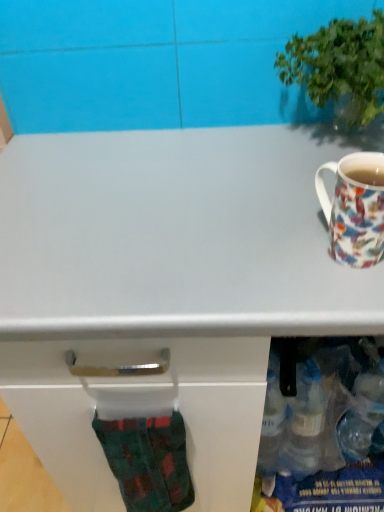
Measure the distance between point (351, 118) and camera.

Point (351, 118) is 30.83 inches away from camera.

What do you see at coordinates (148, 461) in the screenshot? The image size is (384, 512). I see `green plaid sock at lower left` at bounding box center [148, 461].

What is the approximate height of porcelain floral mug at right?

4.62 inches.

This screenshot has width=384, height=512. What are the coordinates of `green leafy plant at upper right` in the screenshot? It's located at (340, 68).

Does point (171, 454) come closer to viewer compared to point (305, 57)?

No, it is behind (305, 57).

From the image's perspective, relative to green leafy plant at upper right, is green plaid sock at lower left above or below?

green plaid sock at lower left is below green leafy plant at upper right.

Can you tell me how much green plaid sock at lower left and green leafy plant at upper right differ in facing direction?

2.52 degrees separate the facing orientations of green plaid sock at lower left and green leafy plant at upper right.

From a real-world perspective, between green plaid sock at lower left and green leafy plant at upper right, who is vertically lower?

From a 3D spatial view, green plaid sock at lower left is below.

From the image's perspective, is porcelain floral mug at right above green plaid sock at lower left?

Yes, from the image's perspective, porcelain floral mug at right is on top of green plaid sock at lower left.

Is point (353, 175) closer or farther from the camera than point (141, 507)?

Point (353, 175) is closer to the camera than point (141, 507).

Is porcelain floral mug at right directly adjacent to green plaid sock at lower left?

porcelain floral mug at right and green plaid sock at lower left are clearly separated.

Measure the distance between porcelain floral mug at right and green plaid sock at lower left.

A distance of 42.63 centimeters exists between porcelain floral mug at right and green plaid sock at lower left.

Image resolution: width=384 pixels, height=512 pixels. Find the location of `coffee cup that is in front of the green leafy plant at upper right`. coffee cup that is in front of the green leafy plant at upper right is located at coordinates (355, 208).

Is porcelain floral mug at right far away from green leafy plant at upper right?

No, porcelain floral mug at right is not far away from green leafy plant at upper right.

From the picture: How much distance is there between porcelain floral mug at right and green leafy plant at upper right?

The distance of porcelain floral mug at right from green leafy plant at upper right is 8.47 inches.

Looking at this image, which point is more distant from viewer, (370,240) or (331,50)?

The point (331,50) is more distant.

Considering the sizes of objects green leafy plant at upper right and green plaid sock at lower left in the image provided, who is bigger, green leafy plant at upper right or green plaid sock at lower left?

With larger size is green leafy plant at upper right.

Where is `sock on the left of green leafy plant at upper right`? This screenshot has width=384, height=512. sock on the left of green leafy plant at upper right is located at coordinates (148, 461).

From the image's perspective, which one is positioned lower, green leafy plant at upper right or green plaid sock at lower left?

From the image's view, green plaid sock at lower left is below.

From the image's perspective, which one is positioned higher, green plaid sock at lower left or porcelain floral mug at right?

porcelain floral mug at right.

Considering the sizes of objects green plaid sock at lower left and porcelain floral mug at right in the image provided, who is bigger, green plaid sock at lower left or porcelain floral mug at right?

green plaid sock at lower left.

Does point (102, 438) come farther from viewer compared to point (371, 167)?

Yes, it is.

Does point (319, 103) lie in front of point (366, 239)?

No, (319, 103) is behind (366, 239).

At what (x,y) coordinates should I click in order to perform the action: click on coffee cup in front of the green leafy plant at upper right. Please return your answer as a coordinate pair (x, y). The image size is (384, 512). Looking at the image, I should click on (355, 208).

Who is taller, green leafy plant at upper right or porcelain floral mug at right?

green leafy plant at upper right is taller.

The width and height of the screenshot is (384, 512). Find the location of `houseplant above the green plaid sock at lower left (from the image's perspective)`. houseplant above the green plaid sock at lower left (from the image's perspective) is located at coordinates (340, 68).

Where is `sock behind the porcelain floral mug at right`? sock behind the porcelain floral mug at right is located at coordinates (148, 461).

Considering their positions, is green leafy plant at upper right positioned further to green plaid sock at lower left than porcelain floral mug at right?

The object further to green plaid sock at lower left is green leafy plant at upper right.

Estimate the real-world distances between objects in this image. Which object is closer to green plaid sock at lower left, porcelain floral mug at right or green leafy plant at upper right?

Among the two, porcelain floral mug at right is located nearer to green plaid sock at lower left.

From the picture: Which object lies further to the anchor point green leafy plant at upper right, porcelain floral mug at right or green plaid sock at lower left?

green plaid sock at lower left lies further to green leafy plant at upper right than the other object.

Consider the image. Estimate the real-world distances between objects in this image. Which object is further from green leafy plant at upper right, green plaid sock at lower left or porcelain floral mug at right?

The object further to green leafy plant at upper right is green plaid sock at lower left.

Based on their spatial positions, is green leafy plant at upper right or green plaid sock at lower left further from porcelain floral mug at right?

green plaid sock at lower left.

Considering their positions, is green plaid sock at lower left positioned closer to porcelain floral mug at right than green leafy plant at upper right?

Among the two, green leafy plant at upper right is located nearer to porcelain floral mug at right.

Locate an element on the screen. Image resolution: width=384 pixels, height=512 pixels. coffee cup between green leafy plant at upper right and green plaid sock at lower left in the up-down direction is located at coordinates (355, 208).